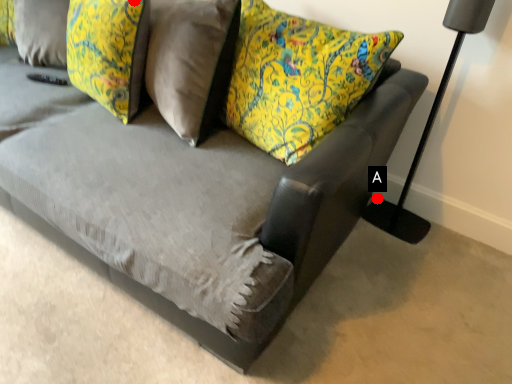
Question: Two points are circled on the image, labeled by A and B beside each circle. Which point is closer to the camera?

Choices:
 (A) A is closer
 (B) B is closer

Answer: (B)